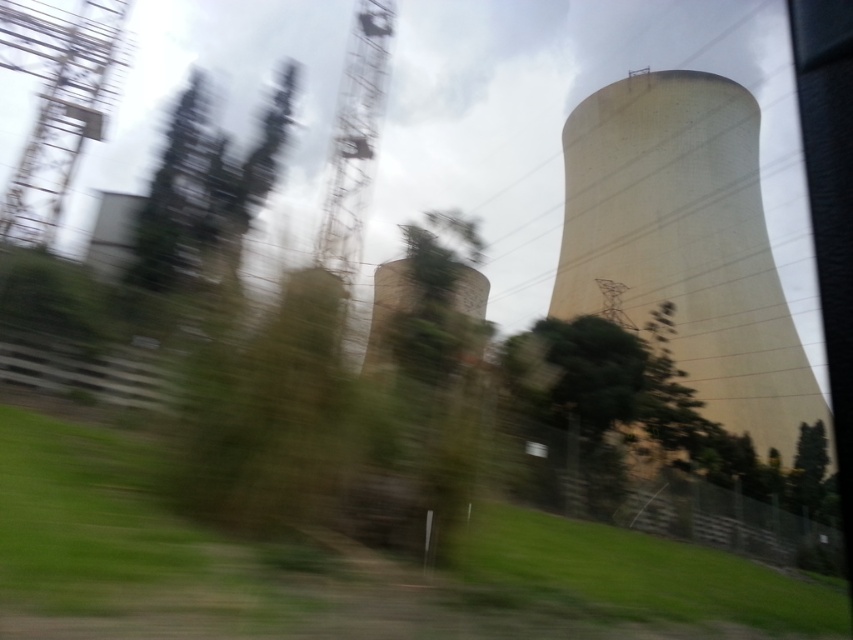
You are a photographer trying to capture both the smooth concrete tower at right and the rusty metal tower at center in a single shot. Based on their positions, which tower would appear closer to the camera in the photo?

The smooth concrete tower at right is below the rusty metal tower at center, so in the photo, the smooth concrete tower at right would appear closer to the camera because it is positioned lower in the frame.

You are a drone operator tasked with flying a drone between the smooth concrete tower at right and the metallic grid tower at upper left. The drone has a maximum flight distance of 25 meters. Can the drone safely fly between these two towers without exceeding its range?

The smooth concrete tower at right and metallic grid tower at upper left are 24.65 meters apart, so yes, the drone can safely fly between them as the distance is within its 25 meter range.

You are a photographer trying to capture the two towers in the scene. You notice that the smooth concrete tower at right and the metallic grid tower at upper left have different widths. Which tower is wider?

The smooth concrete tower at right is wider than the metallic grid tower at upper left.